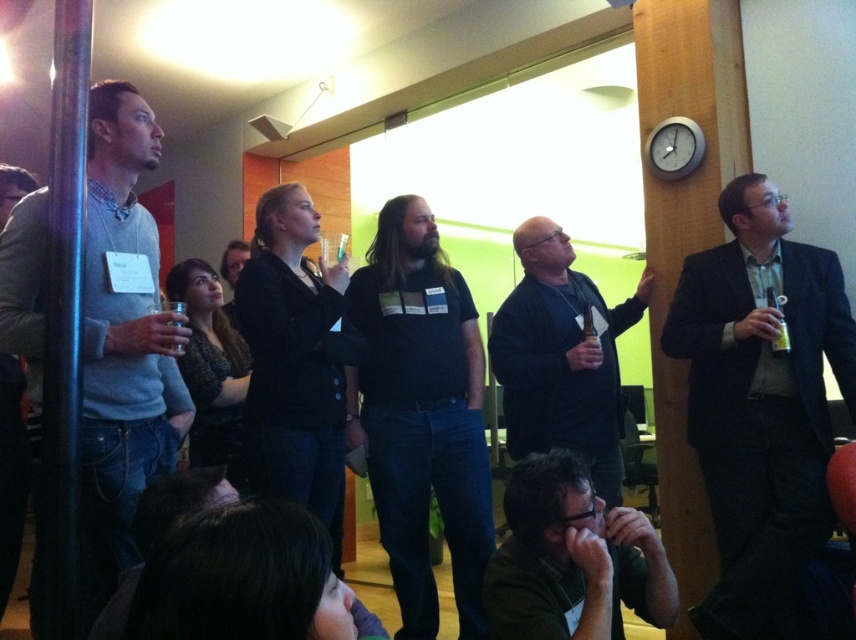
You are standing in the conference room and want to move from the point closer to the camera to the point further away. Which path should you take to go from the point at coordinates point (91, 195) to the point at coordinates point (615, 422)?

You should move towards the point at coordinates point (615, 422) since it is further away from the camera compared to point (91, 195).

You are organizing a clothing donation drive and need to categorize items based on their thickness. You have two sweaters to sort out. The matte gray sweater at left and the dark gray sweater at center. Which one should you place in the section for thinner garments?

The matte gray sweater at left is thinner than the dark gray sweater at center, so it should be placed in the section for thinner garments.

You are a photographer positioned at the back of the room. You want to take a photo that includes both the matte gray sweater at left and the green matte shirt at lower center. Which object should you adjust your focus on first to ensure both are in frame?

Since the matte gray sweater at left is closer to the viewer than the green matte shirt at lower center, you should focus on the matte gray sweater at left first to ensure both are in frame.